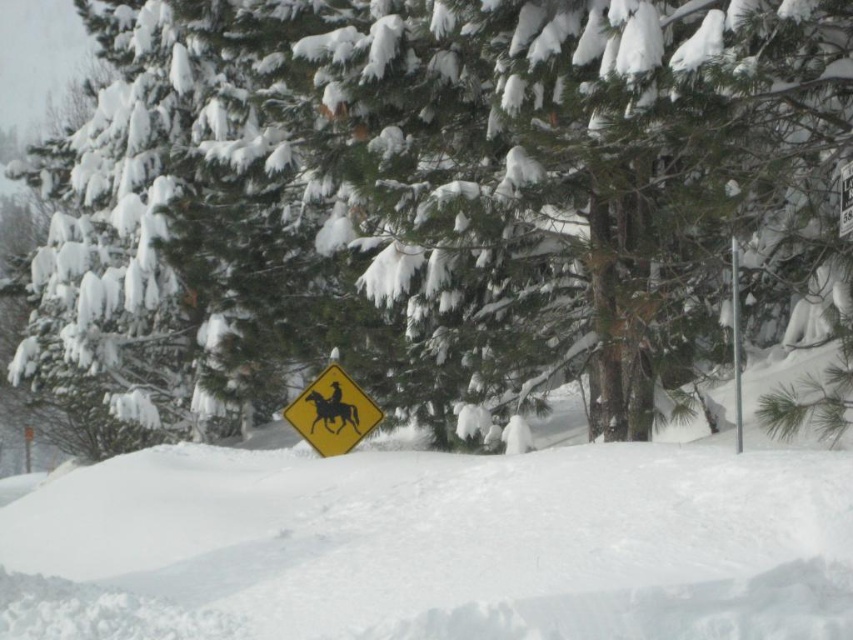
Between snow-covered evergreen tree at center and white fluffy snow at lower center, which one appears on the left side from the viewer's perspective?

snow-covered evergreen tree at center is more to the left.

Can you confirm if snow-covered evergreen tree at center is bigger than white fluffy snow at lower center?

Yes, snow-covered evergreen tree at center is bigger than white fluffy snow at lower center.

What do you see at coordinates (442, 204) in the screenshot? The width and height of the screenshot is (853, 640). I see `snow-covered evergreen tree at center` at bounding box center [442, 204].

Image resolution: width=853 pixels, height=640 pixels. Find the location of `snow-covered evergreen tree at center`. snow-covered evergreen tree at center is located at coordinates (442, 204).

Is snow-covered evergreen tree at center thinner than smooth yellow sign at center?

No, snow-covered evergreen tree at center is not thinner than smooth yellow sign at center.

Does snow-covered evergreen tree at center lie in front of smooth yellow sign at center?

Yes.

Does point (248, 204) lie behind point (352, 404)?

Yes, point (248, 204) is behind point (352, 404).

The height and width of the screenshot is (640, 853). I want to click on snow-covered evergreen tree at center, so click(x=442, y=204).

Does white fluffy snow at lower center appear on the right side of yellow diamond-shaped sign at center?

No, white fluffy snow at lower center is not to the right of yellow diamond-shaped sign at center.

Is white fluffy snow at lower center bigger than yellow diamond-shaped sign at center?

Correct, white fluffy snow at lower center is larger in size than yellow diamond-shaped sign at center.

Is point (685, 492) positioned in front of point (370, 410)?

Yes.

You are a GUI agent. You are given a task and a screenshot of the screen. Output one action in this format:
    pyautogui.click(x=<x>, y=<y>)
    Task: Click on the white fluffy snow at lower center
    The height and width of the screenshot is (640, 853).
    Given the screenshot: What is the action you would take?
    pyautogui.click(x=432, y=545)